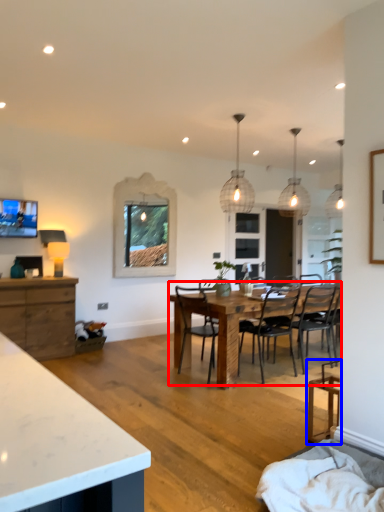
Question: Which point is closer to the camera, kitchen & dining room table (highlighted by a red box) or chair (highlighted by a blue box)?

Choices:
 (A) kitchen & dining room table
 (B) chair

Answer: (B)